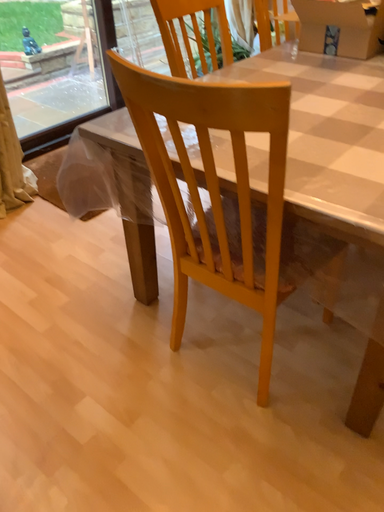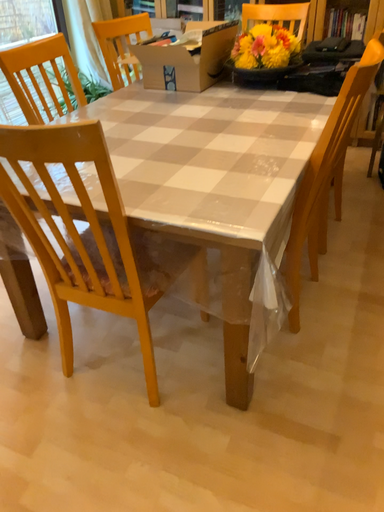
Question: How did the camera likely rotate when shooting the video?

Choices:
 (A) rotated right
 (B) rotated left

Answer: (A)